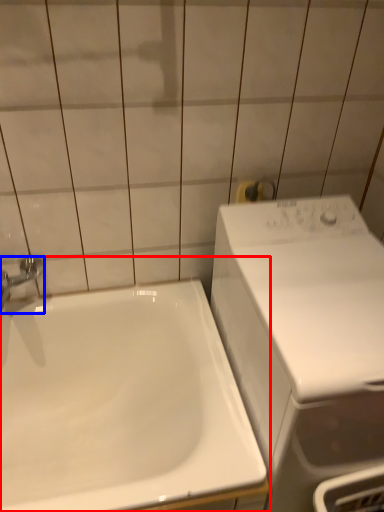
Question: Which object appears closest to the camera in this image, sink (highlighted by a red box) or tap (highlighted by a blue box)?

Choices:
 (A) sink
 (B) tap

Answer: (A)